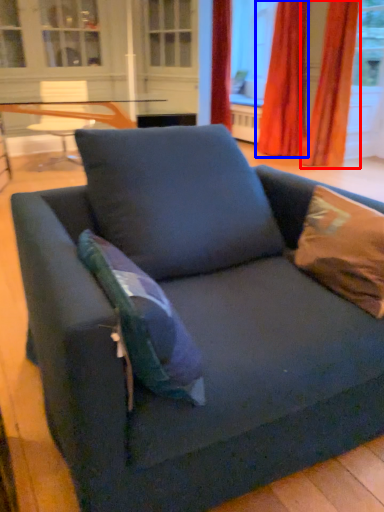
Question: Which object appears farthest to the camera in this image, curtain (highlighted by a red box) or curtain (highlighted by a blue box)?

Choices:
 (A) curtain
 (B) curtain

Answer: (B)